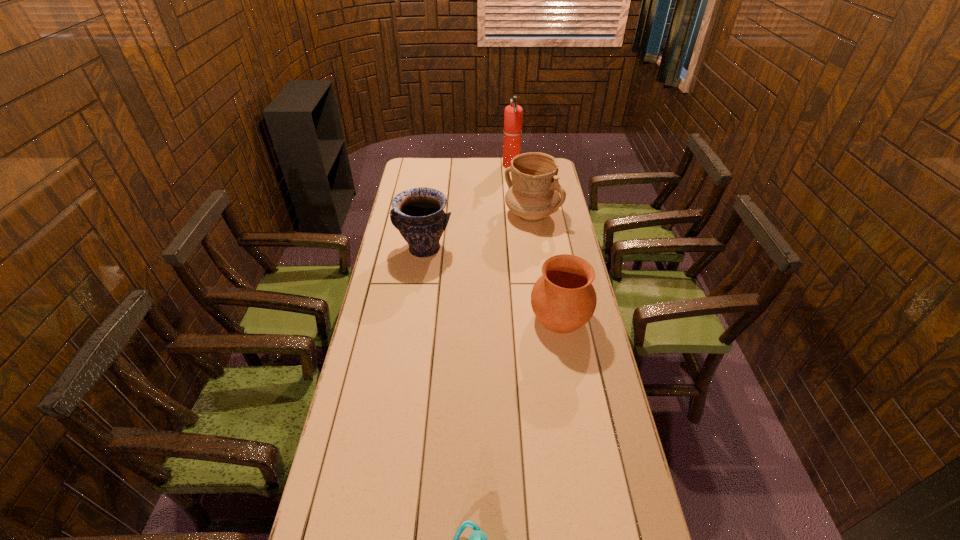
At what (x,y) coordinates should I click in order to perform the action: click on free location located 0.150m on the front handle of the leftmost object. Please return your answer as a coordinate pair (x, y). Looking at the image, I should click on (418, 293).

Where is `vacant space located on the left of the nearest pottery`? vacant space located on the left of the nearest pottery is located at coordinates click(444, 318).

The image size is (960, 540). I want to click on object present at the far edge, so click(513, 114).

The image size is (960, 540). In order to click on object at the left edge in this screenshot , I will do `click(417, 213)`.

In the image, there is a desktop. Where is `vacant space at the far edge`? This screenshot has height=540, width=960. vacant space at the far edge is located at coordinates (499, 163).

Image resolution: width=960 pixels, height=540 pixels. What are the coordinates of `free space at the left edge` in the screenshot? It's located at (416, 295).

Where is `vacant area at the far left corner of the desktop`? Image resolution: width=960 pixels, height=540 pixels. vacant area at the far left corner of the desktop is located at coordinates (431, 179).

Locate an element on the screen. The width and height of the screenshot is (960, 540). vacant space in between the nearest pottery and the second farthest pottery is located at coordinates (492, 284).

In order to click on empty space between the leftmost object and the nearest pottery in this screenshot , I will do tap(492, 284).

The height and width of the screenshot is (540, 960). I want to click on vacant space that is in between the tallest object and the nearest pottery, so click(536, 241).